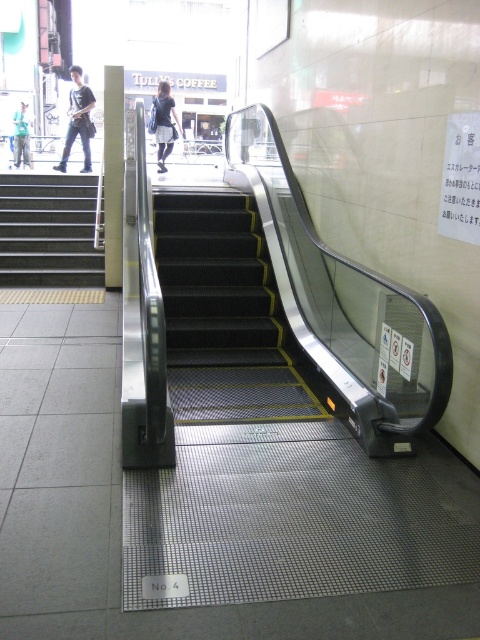
You are a person with a wheelchair trying to navigate through the public transportation hub. You see the metallic gray stairs at left and dark blue jeans at left. Which of these two can you pass through easily?

The dark blue jeans at left can be passed through easily since the metallic gray stairs at left are wider than the dark blue jeans at left, making the stairs an obstacle for wheelchair navigation.

You are a delivery person carrying a large box that is 2 meters long. You need to move from the bottom of the escalator to the top. Is there enough space between the metallic gray stairs at left and the matte black skirt at upper center to maneuver your box without tilting it?

The distance between the metallic gray stairs at left and the matte black skirt at upper center is 3.85 meters. Since your box is 2 meters long, there is sufficient space to maneuver it without tilting.

You are a delivery person carrying a large box that is 1.2 meters wide. You need to navigate around the metallic gray stairs at left and the matte black skirt at upper center. Which object do you need to avoid to prevent the box from getting stuck?

You should avoid the metallic gray stairs at left because it might be wider than the matte black skirt at upper center, so the box might get stuck if it goes near the wider area.